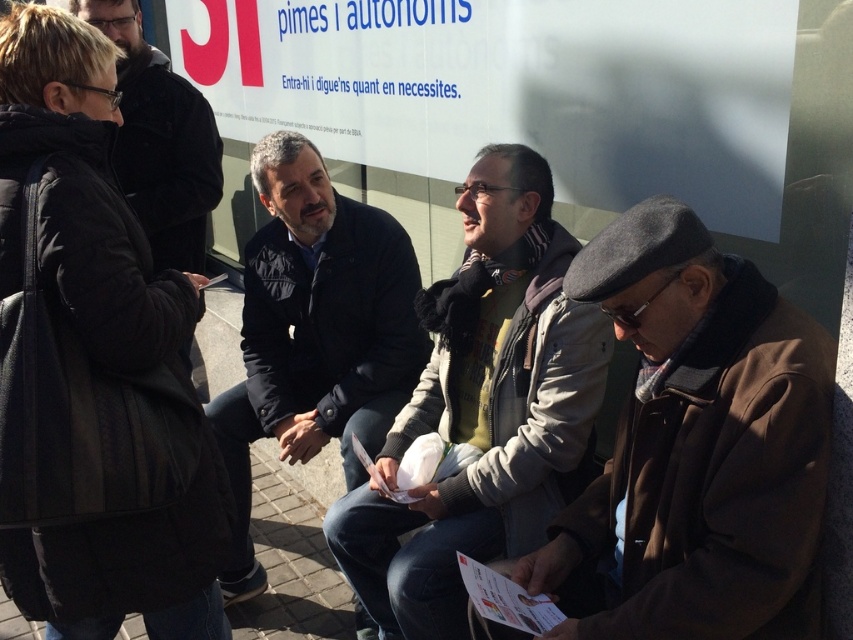
You are a delivery person needing to deliver a package to the brown woolen jacket at center. You are currently standing next to the black matte jacket at upper left. Can you hand over the package without moving more than 6 feet from your current position?

The distance between the brown woolen jacket at center and the black matte jacket at upper left is 6.81 feet, which is slightly more than 6 feet. Therefore, you would need to move more than 6 feet to deliver the package.

You are a tailor trying to fit a new jacket for a customer. You have two jackets in front of you, the brown woolen jacket at center and the dark blue jacket at center. Which jacket is shorter in height?

The brown woolen jacket at center is not as tall as dark blue jacket at center, so the brown woolen jacket at center is shorter in height.